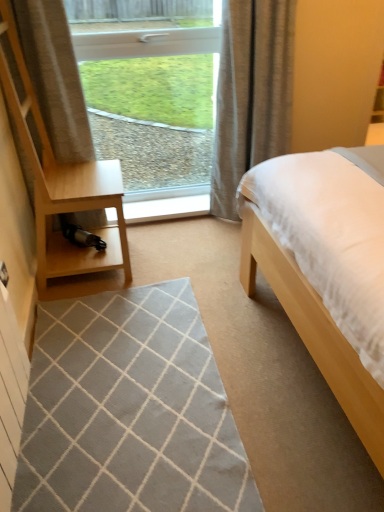
You are a GUI agent. You are given a task and a screenshot of the screen. Output one action in this format:
    pyautogui.click(x=<x>, y=<y>)
    Task: Click on the vacant area to the right of light wood/dark finish dresser at left
    The image size is (384, 512).
    Given the screenshot: What is the action you would take?
    pyautogui.click(x=160, y=255)